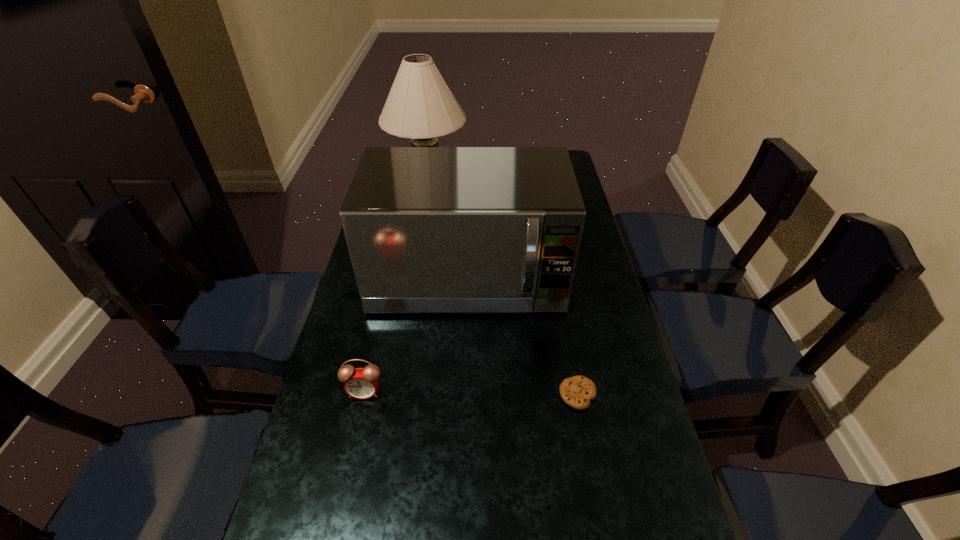
Find the location of `free space that is in between the microwave oven and the shortest object`. free space that is in between the microwave oven and the shortest object is located at coordinates (522, 337).

Where is `free spot between the third shortest object and the alarm clock`? This screenshot has height=540, width=960. free spot between the third shortest object and the alarm clock is located at coordinates (416, 336).

At what (x,y) coordinates should I click in order to perform the action: click on vacant region between the shortest object and the second shortest object. Please return your answer as a coordinate pair (x, y). This screenshot has height=540, width=960. Looking at the image, I should click on (471, 393).

Identify which object is the third nearest to the second tallest object. Please provide its 2D coordinates. Your answer should be formatted as a tuple, i.e. [(x, y)], where the tuple contains the x and y coordinates of a point satisfying the conditions above.

[(361, 383)]

Find the location of a particular element. object that is the third closest one to the tallest object is located at coordinates (577, 391).

Locate an element on the screen. free location that satisfies the following two spatial constraints: 1. on the front side of the shortest object; 2. on the left side of the farthest object is located at coordinates (397, 394).

You are a GUI agent. You are given a task and a screenshot of the screen. Output one action in this format:
    pyautogui.click(x=<x>, y=<y>)
    Task: Click on the blank area in the image that satisfies the following two spatial constraints: 1. with the door open on the second tallest object; 2. on the right side of the cookie
    
    Given the screenshot: What is the action you would take?
    pyautogui.click(x=464, y=394)